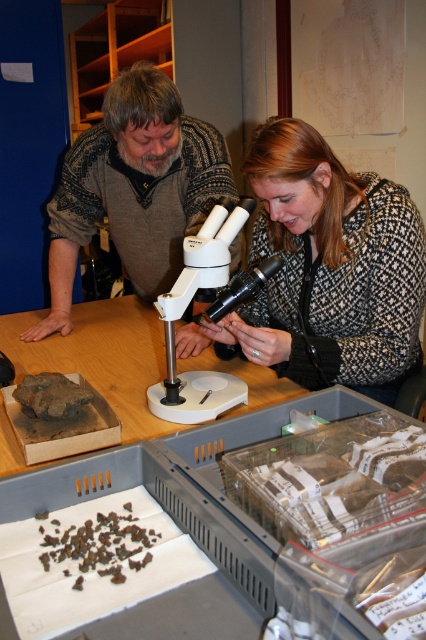
You are an observer standing in the room. You see a patterned fabric coat at center and a brown knitted sweater at center. Which clothing item is positioned more to the right?

The patterned fabric coat at center is positioned more to the right than the brown knitted sweater at center.

What object is located at the coordinates point (100, 356)?

The point (100, 356) corresponds to the wooden table at center.

You are standing in a room and see a point at coordinates (328, 269). What object is located at that point?

The patterned fabric coat at center is located at point (328, 269).